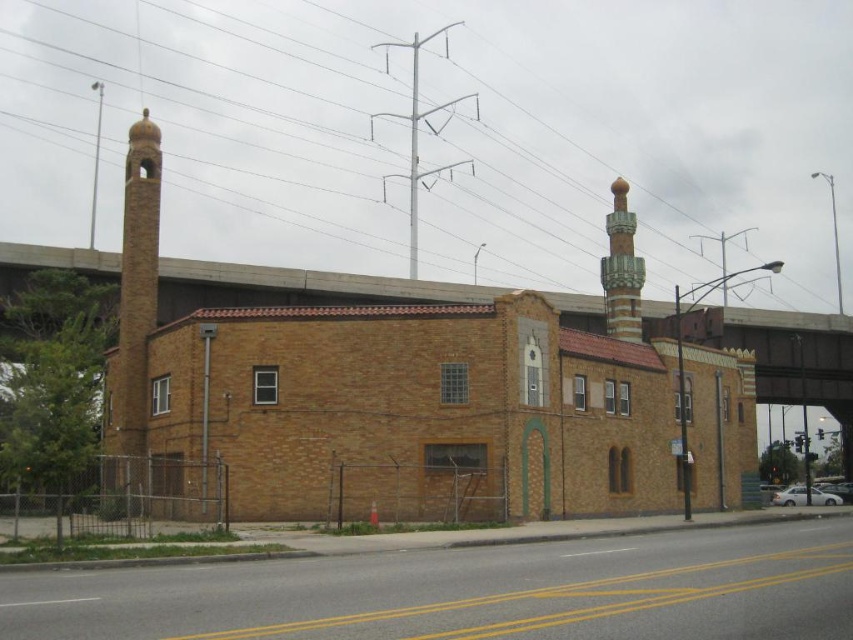
You are a drone operator planning to fly a drone over the two minarets on the building. The drone has a maximum flight height of 5 meters. According to the image, will the drone be able to fly between the two minarets without hitting the metallic gray power line at upper center located at point (x=450, y=129)?

The metallic gray power line at upper center is located at point (x=450, y=129). Since the drone has a maximum flight height of 5 meters, it can safely fly below the power line as long as the power line is above 5 meters. However, without specific height data, we cannot confirm if the drone will hit the power line. The question cannot be definitively answered with the provided information.

You are standing at the base of the left minaret and want to walk towards the right minaret. As you move forward, will the point at coordinate point (560, 81) become visible or hidden relative to point (767, 372)?

The point at coordinate point (560, 81) is behind point (767, 372), so as you move towards the right minaret, the point at coordinate point (560, 81) will become hidden behind point (767, 372).

You are an architect evaluating the building facade. You notice the metallic gray power line at upper center and the green glazed tile minaret at upper right. Which of these two objects has a greater width?

The metallic gray power line at upper center has a greater width than the green glazed tile minaret at upper right according to the description.